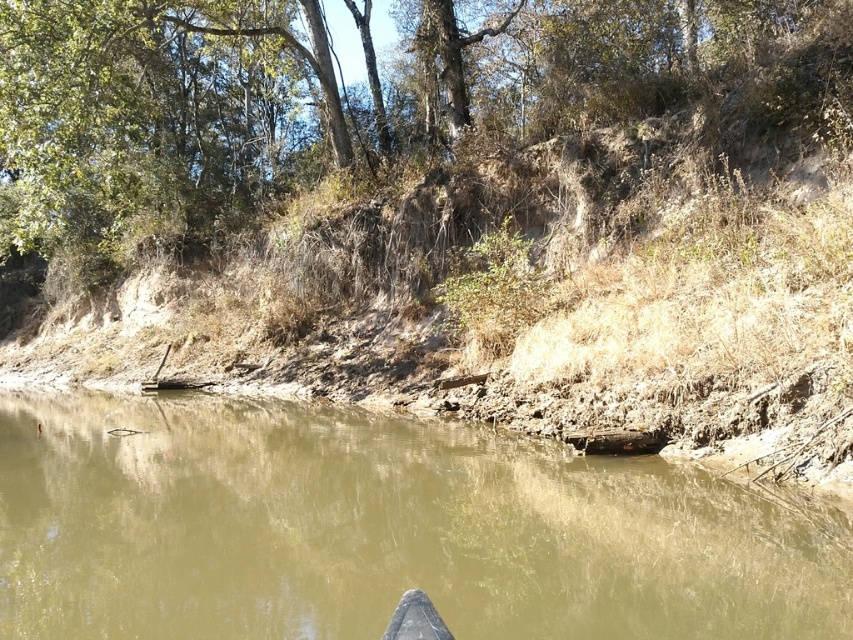
Image resolution: width=853 pixels, height=640 pixels. What do you see at coordinates (376, 531) in the screenshot?
I see `brown muddy water at center` at bounding box center [376, 531].

Does brown muddy water at center have a smaller size compared to green leafy tree at upper center?

Indeed, brown muddy water at center has a smaller size compared to green leafy tree at upper center.

Locate an element on the screen. brown muddy water at center is located at coordinates (376, 531).